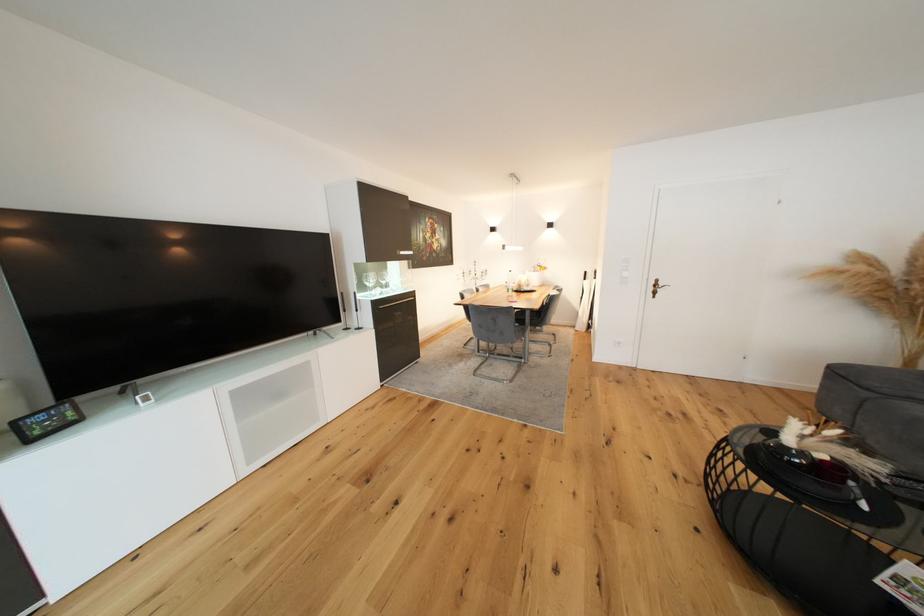
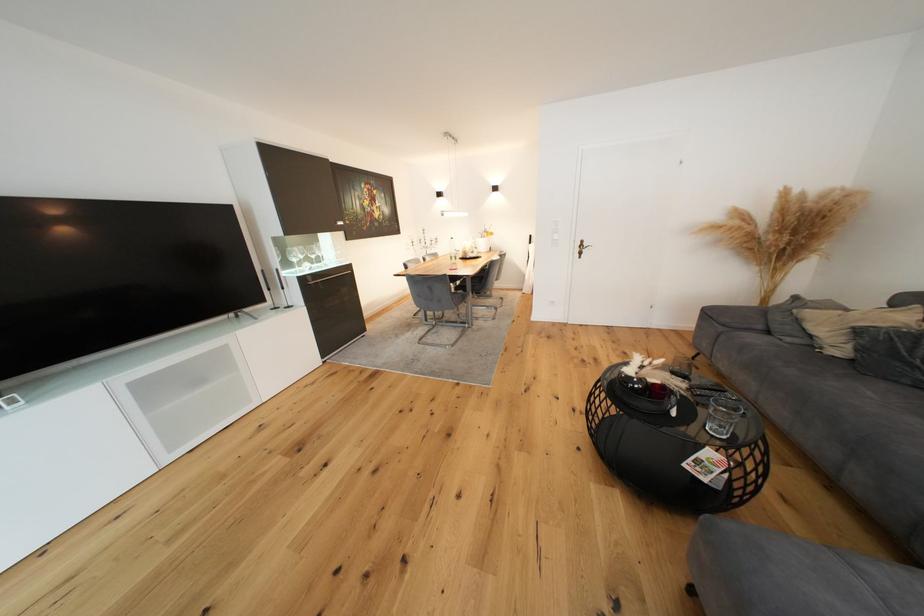
The point at (886, 585) is marked in the first image. Where is the corresponding point in the second image?

(691, 467)